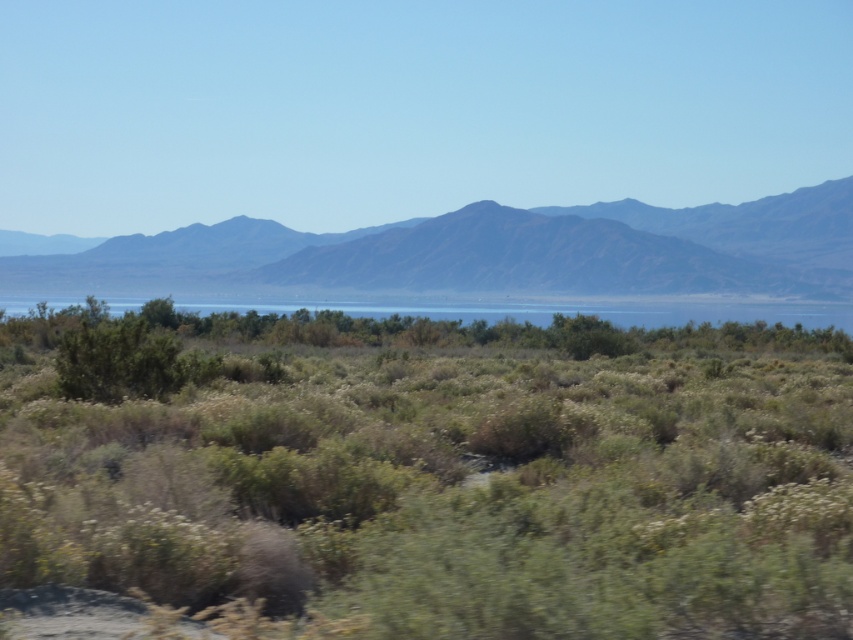
At what (x,y) coordinates should I click in order to perform the action: click on green shrubbery at center. Please return your answer as a coordinate pair (x, y). Looking at the image, I should click on (438, 477).

Which is behind, point (602, 621) or point (587, 248)?

The point (587, 248) is behind.

The image size is (853, 640). Describe the element at coordinates (438, 477) in the screenshot. I see `green shrubbery at center` at that location.

Locate an element on the screen. The image size is (853, 640). green shrubbery at center is located at coordinates (438, 477).

Can you confirm if green shrubbery at center is positioned above clear blue water at center?

Incorrect, green shrubbery at center is not positioned above clear blue water at center.

Is green shrubbery at center smaller than clear blue water at center?

Yes.

Between point (287, 461) and point (532, 308), which one is positioned behind?

Positioned behind is point (532, 308).

In order to click on green shrubbery at center in this screenshot , I will do `click(438, 477)`.

Who is more forward, (409,276) or (672,308)?

Point (672,308)

Is rugged brown mountain at center shorter than clear blue water at center?

Incorrect, rugged brown mountain at center's height does not fall short of clear blue water at center's.

This screenshot has height=640, width=853. Identify the location of rugged brown mountain at center. (500, 252).

Identify the location of rugged brown mountain at center. This screenshot has width=853, height=640. (500, 252).